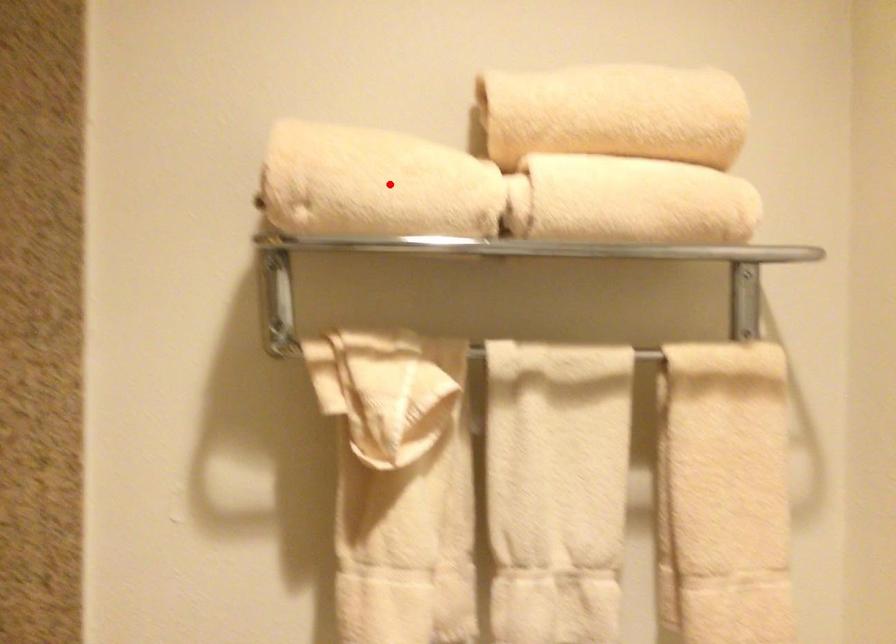
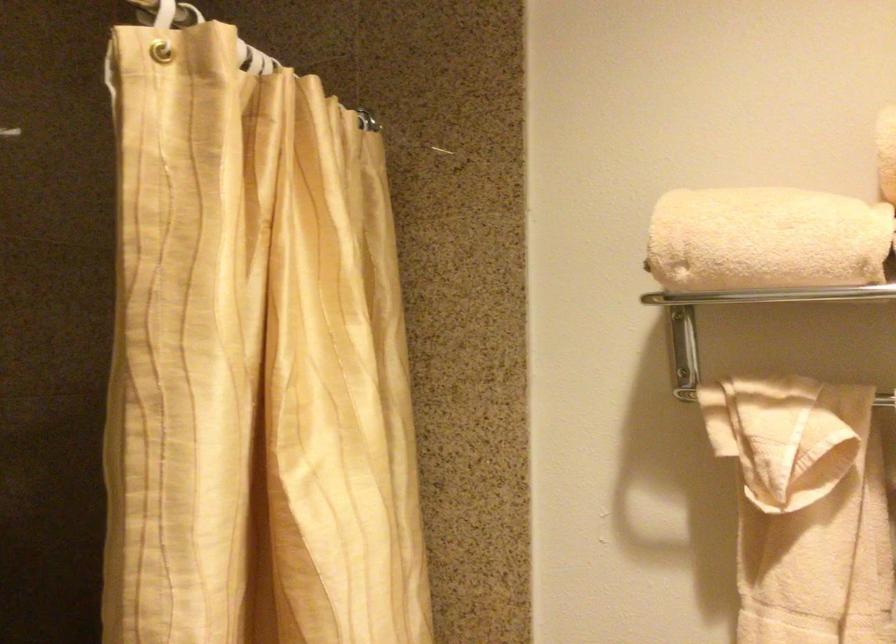
In the second image, find the point that corresponds to the highlighted location in the first image.

(765, 240)